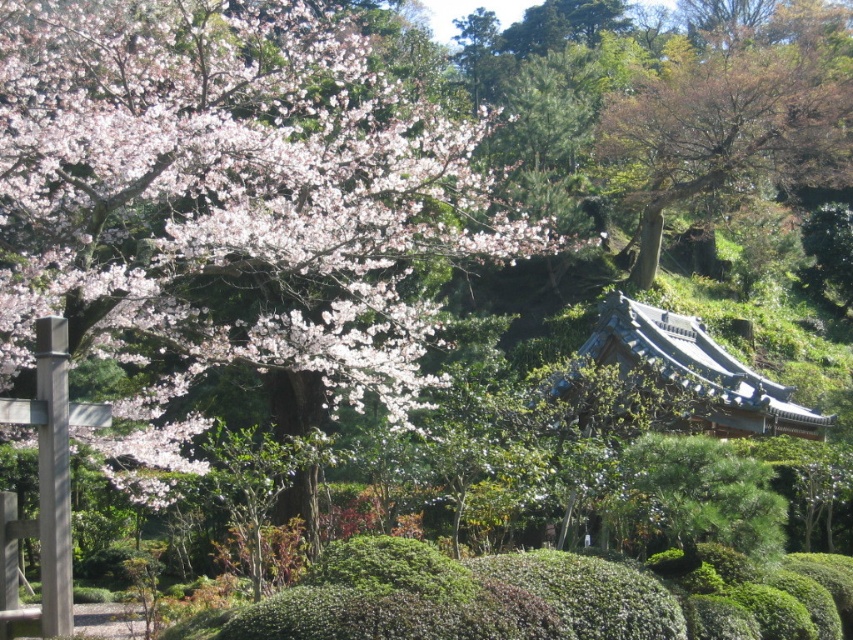
Question: Does soft pink blossoms at upper left appear on the right side of brown textured tree at upper right?

Choices:
 (A) yes
 (B) no

Answer: (B)

Question: Which of the following is the closest to the observer?

Choices:
 (A) brown textured tree at upper right
 (B) soft pink blossoms at upper left

Answer: (B)

Question: Can you confirm if soft pink blossoms at upper left is positioned below brown textured tree at upper right?

Choices:
 (A) no
 (B) yes

Answer: (B)

Question: Which point is farther to the camera?

Choices:
 (A) brown textured tree at upper right
 (B) soft pink blossoms at upper left

Answer: (A)

Question: Is soft pink blossoms at upper left wider than brown textured tree at upper right?

Choices:
 (A) yes
 (B) no

Answer: (B)